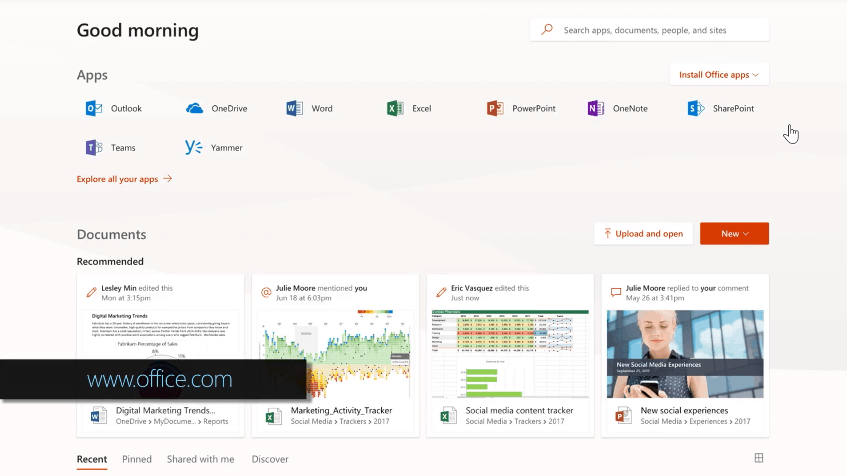
Where is `documents`? The image size is (847, 476). documents is located at coordinates (100, 232).